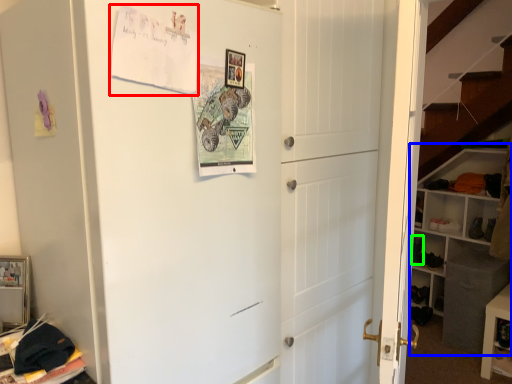
Question: Which object is the farthest from postcard (highlighted by a red box)? Choose among these: bookshelf (highlighted by a blue box) or shoe (highlighted by a green box).

Choices:
 (A) bookshelf
 (B) shoe

Answer: (B)